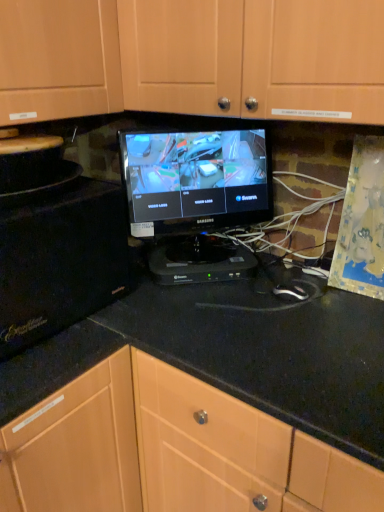
Image resolution: width=384 pixels, height=512 pixels. Describe the element at coordinates (290, 292) in the screenshot. I see `black plastic mouse at center` at that location.

What do you see at coordinates (55, 242) in the screenshot? I see `black matte microwave at left, the first appliance in the left-to-right sequence` at bounding box center [55, 242].

Measure the distance between point (177, 284) and camera.

Point (177, 284) and camera are 1.21 meters apart from each other.

Where is `black plastic mouse at center`? This screenshot has height=512, width=384. black plastic mouse at center is located at coordinates (290, 292).

From a real-world perspective, is black granite countertop at center on top of black glossy monitor at center?

No, from a real-world perspective, black granite countertop at center is not over black glossy monitor at center

Which is correct: black granite countertop at center is inside black glossy monitor at center, or outside of it?

black granite countertop at center exists outside the volume of black glossy monitor at center.

Is point (283, 357) farther from viewer compared to point (229, 254)?

No, it is in front of (229, 254).

Between black granite countertop at center and black glossy monitor at center, which one has larger size?

black granite countertop at center is bigger.

From a real-world perspective, which object stands above the other?

From a 3D spatial view, wooden cabinet at upper center is above.

Is wooden cabinet at upper center outside of black glossy monitor at center?

wooden cabinet at upper center lies outside black glossy monitor at center's area.

Consider the image. Considering the positions of objects wooden cabinet at upper center and black glossy monitor at center in the image provided, who is more to the right, wooden cabinet at upper center or black glossy monitor at center?

wooden cabinet at upper center is more to the right.

Looking at this image, how distant is black plastic mouse at center from black plastic device at center, which is the first appliance in right-to-left order?

black plastic mouse at center is 8.91 inches from black plastic device at center, which is the first appliance in right-to-left order.

Between black plastic mouse at center and black plastic device at center, which is the first appliance in right-to-left order, which one has less height?

black plastic mouse at center.

Find the location of `appliance that appears behind the black plastic mouse at center`. appliance that appears behind the black plastic mouse at center is located at coordinates (200, 261).

Is black plastic mouse at center inside the boundaries of black plastic device at center, which is the first appliance in right-to-left order, or outside?

black plastic mouse at center is outside black plastic device at center, which is the first appliance in right-to-left order.

Which of these two, black granite countertop at center or black plastic device at center, which is the first appliance in right-to-left order, is bigger?

black granite countertop at center is bigger.

Between point (336, 355) and point (184, 239), which one is positioned in front?

The point (336, 355) is closer to the camera.

Considering the positions of objects black granite countertop at center and black plastic device at center, which is the first appliance in right-to-left order, in the image provided, who is more to the right, black granite countertop at center or black plastic device at center, which is the first appliance in right-to-left order,?

black granite countertop at center.

The width and height of the screenshot is (384, 512). Identify the location of appliance behind the black matte microwave at left, arranged as the second appliance when viewed from the right. (200, 261).

From the image's perspective, between black matte microwave at left, arranged as the second appliance when viewed from the right, and black plastic device at center, arranged as the 2th appliance when viewed from the left, which one is located above?

From the image's view, black matte microwave at left, arranged as the second appliance when viewed from the right, is above.

Based on their sizes in the image, would you say black matte microwave at left, the first appliance in the left-to-right sequence, is bigger or smaller than black plastic device at center, arranged as the 2th appliance when viewed from the left?

Considering their sizes, black matte microwave at left, the first appliance in the left-to-right sequence, takes up more space than black plastic device at center, arranged as the 2th appliance when viewed from the left.

Which is correct: black matte microwave at left, the first appliance in the left-to-right sequence, is inside black plastic device at center, arranged as the 2th appliance when viewed from the left, or outside of it?

black matte microwave at left, the first appliance in the left-to-right sequence, is spatially situated outside black plastic device at center, arranged as the 2th appliance when viewed from the left.

In terms of size, does wooden cabinet at upper center appear bigger or smaller than black granite countertop at center?

In the image, wooden cabinet at upper center appears to be smaller than black granite countertop at center.

Between wooden cabinet at upper center and black granite countertop at center, which one has more height?

Standing taller between the two is black granite countertop at center.

Is wooden cabinet at upper center wider than black granite countertop at center?

In fact, wooden cabinet at upper center might be narrower than black granite countertop at center.

Could black glossy monitor at center be considered to be inside black plastic mouse at center?

Definitely not — black glossy monitor at center is not inside black plastic mouse at center.

Based on the photo, considering the sizes of objects black plastic mouse at center and black glossy monitor at center in the image provided, who is wider, black plastic mouse at center or black glossy monitor at center?

black glossy monitor at center.

Considering the relative sizes of black plastic mouse at center and black glossy monitor at center in the image provided, is black plastic mouse at center smaller than black glossy monitor at center?

Yes.

Identify the location of counter top located in front of the black glossy monitor at center. The image size is (384, 512). (269, 349).

At what (x,y) coordinates should I click in order to perform the action: click on computer monitor that appears behind the wooden cabinet at upper center. Please return your answer as a coordinate pair (x, y). The width and height of the screenshot is (384, 512). Looking at the image, I should click on (196, 198).

Which object lies nearer to the anchor point wooden cabinet at upper center, black plastic device at center, arranged as the 2th appliance when viewed from the left, or black matte microwave at left, arranged as the second appliance when viewed from the right?

Among the two, black matte microwave at left, arranged as the second appliance when viewed from the right, is located nearer to wooden cabinet at upper center.

From the picture: From the image, which object appears to be nearer to black matte microwave at left, the first appliance in the left-to-right sequence, black glossy monitor at center or wooden cabinet at upper center?

black glossy monitor at center is closer to black matte microwave at left, the first appliance in the left-to-right sequence.

When comparing their distances from wooden cabinet at upper center, does black granite countertop at center or black matte microwave at left, the first appliance in the left-to-right sequence, seem further?

Among the two, black granite countertop at center is located further to wooden cabinet at upper center.

Which object lies nearer to the anchor point black matte microwave at left, the first appliance in the left-to-right sequence, black granite countertop at center or wooden cabinet at upper center?

black granite countertop at center is positioned closer to the anchor black matte microwave at left, the first appliance in the left-to-right sequence.

Based on their spatial positions, is black plastic device at center, arranged as the 2th appliance when viewed from the left, or black plastic mouse at center closer to black glossy monitor at center?

Among the two, black plastic device at center, arranged as the 2th appliance when viewed from the left, is located nearer to black glossy monitor at center.

Considering their positions, is black granite countertop at center positioned closer to black plastic mouse at center than black glossy monitor at center?

Based on the image, black granite countertop at center appears to be nearer to black plastic mouse at center.

From the image, which object appears to be farther from black plastic mouse at center, black glossy monitor at center or black granite countertop at center?

Based on the image, black glossy monitor at center appears to be further to black plastic mouse at center.

Considering their positions, is black granite countertop at center positioned further to black glossy monitor at center than wooden cabinet at upper center?

wooden cabinet at upper center is further to black glossy monitor at center.

The image size is (384, 512). In order to click on computer monitor between wooden cabinet at upper center and black plastic mouse at center vertically in this screenshot , I will do `click(196, 198)`.

You are a GUI agent. You are given a task and a screenshot of the screen. Output one action in this format:
    pyautogui.click(x=<x>, y=<y>)
    Task: Click on the computer monitor between black matte microwave at left, arranged as the second appliance when viewed from the right, and black plastic mouse at center from left to right
    
    Given the screenshot: What is the action you would take?
    pyautogui.click(x=196, y=198)

The width and height of the screenshot is (384, 512). I want to click on computer monitor between black matte microwave at left, arranged as the second appliance when viewed from the right, and wooden cabinet at upper center, so click(x=196, y=198).

I want to click on appliance located between black matte microwave at left, the first appliance in the left-to-right sequence, and black plastic mouse at center in the left-right direction, so click(x=200, y=261).